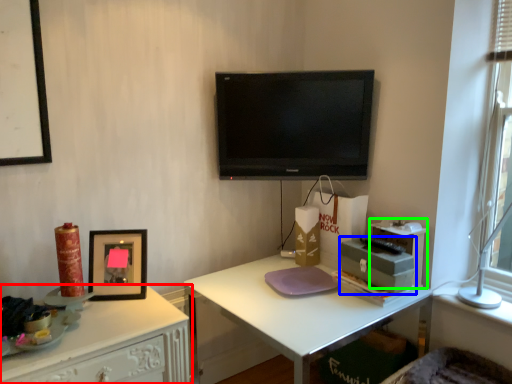
Question: Estimate the real-world distances between objects in this image. Which object is closer to desk (highlighted by a red box), box (highlighted by a blue box) or box (highlighted by a green box)?

Choices:
 (A) box
 (B) box

Answer: (A)